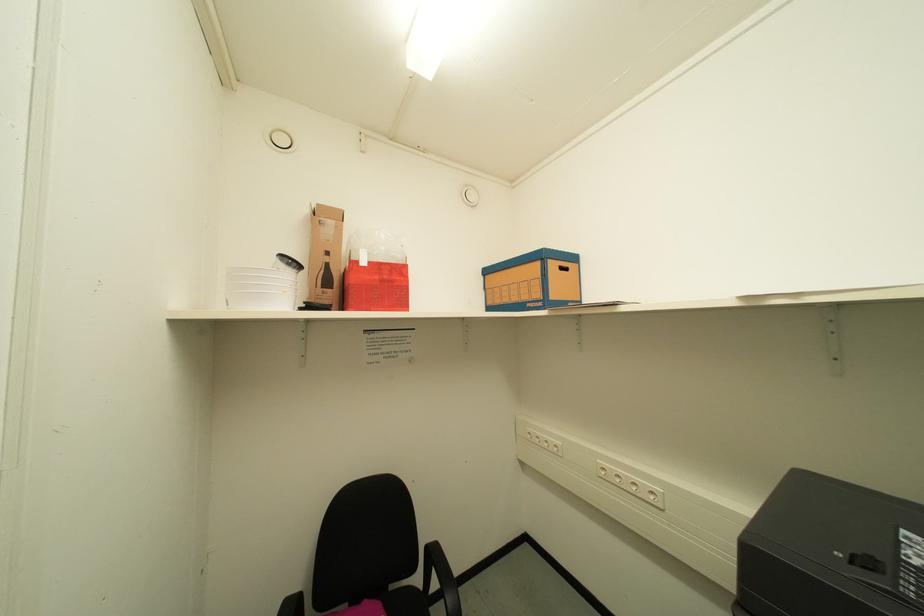
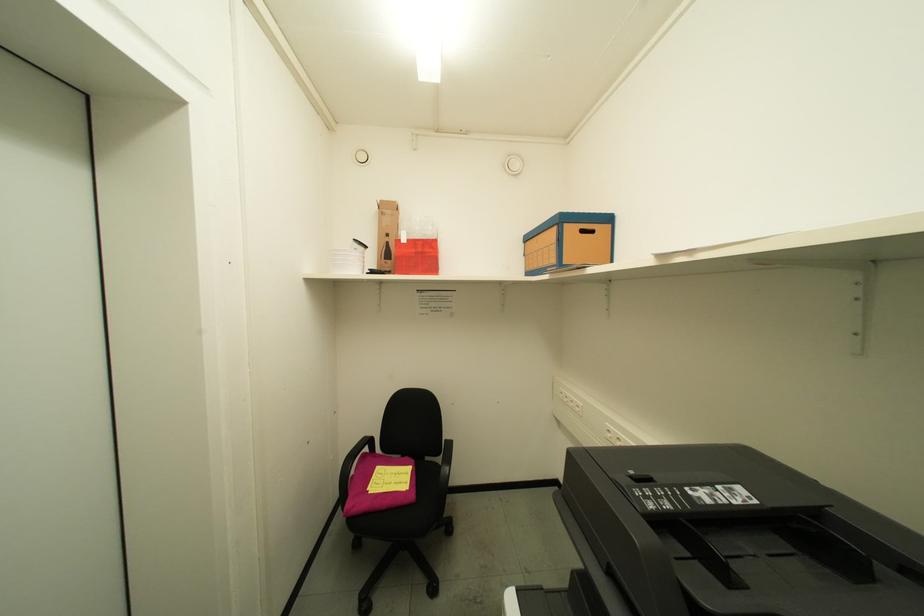
Question: The camera is either moving clockwise (left) or counter-clockwise (right) around the object. The first image is from the beginning of the video and the second image is from the end. Is the camera moving left or right when shooting the video?

Choices:
 (A) Left
 (B) Right

Answer: (B)